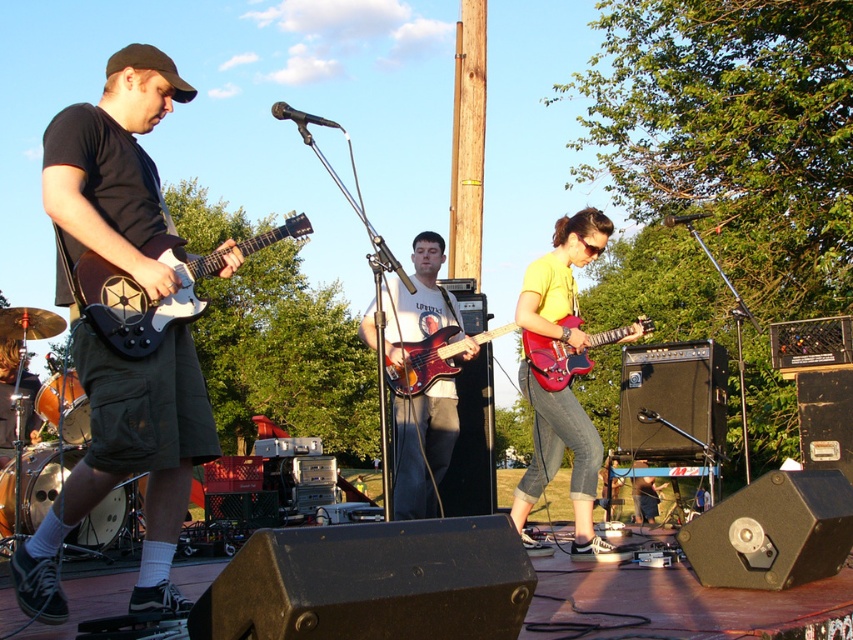
Which is more to the right, wooden bass guitar at center or white matte electric guitar at left?

Positioned to the right is wooden bass guitar at center.

Can you confirm if wooden bass guitar at center is positioned below white matte electric guitar at left?

Indeed, wooden bass guitar at center is positioned under white matte electric guitar at left.

Is point (421, 496) behind point (151, 252)?

Yes.

Find the location of a particular element. The width and height of the screenshot is (853, 640). wooden bass guitar at center is located at coordinates (422, 448).

Does matte red electric guitar at center have a greater height compared to glossy wood bass guitar at center?

Yes.

Does matte red electric guitar at center have a greater width compared to glossy wood bass guitar at center?

No, matte red electric guitar at center is not wider than glossy wood bass guitar at center.

Which is behind, point (593, 483) or point (434, 358)?

The point (434, 358) is behind.

At what (x,y) coordinates should I click in order to perform the action: click on matte red electric guitar at center. Please return your answer as a coordinate pair (x, y). Looking at the image, I should click on (560, 465).

Is shiny red electric guitar at center below glossy wood bass guitar at center?

Actually, shiny red electric guitar at center is above glossy wood bass guitar at center.

Does point (581, 362) come closer to viewer compared to point (505, 330)?

No, it is not.

In order to click on shiny red electric guitar at center in this screenshot , I will do `click(553, 360)`.